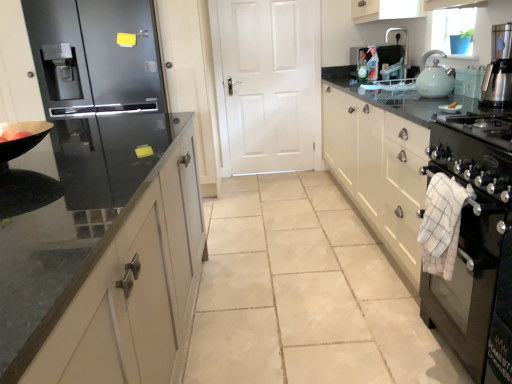
Question: Is white checkered towel at right thinner than black glossy countertop at right?

Choices:
 (A) yes
 (B) no

Answer: (A)

Question: From a real-world perspective, does white checkered towel at right sit lower than black glossy countertop at right?

Choices:
 (A) no
 (B) yes

Answer: (A)

Question: Could you tell me if white checkered towel at right is facing black glossy countertop at right?

Choices:
 (A) no
 (B) yes

Answer: (A)

Question: Does white checkered towel at right touch black glossy countertop at right?

Choices:
 (A) no
 (B) yes

Answer: (A)

Question: Could black glossy countertop at right be considered to be inside white checkered towel at right?

Choices:
 (A) no
 (B) yes

Answer: (A)

Question: From a real-world perspective, is matte orange tomato at left positioned above or below black glossy countertop at right?

Choices:
 (A) below
 (B) above

Answer: (B)

Question: Is point (18, 132) positioned closer to the camera than point (474, 268)?

Choices:
 (A) closer
 (B) farther

Answer: (B)

Question: From the image's perspective, is matte orange tomato at left located above or below black glossy countertop at right?

Choices:
 (A) above
 (B) below

Answer: (B)

Question: From their relative heights in the image, would you say matte orange tomato at left is taller or shorter than black glossy countertop at right?

Choices:
 (A) short
 (B) tall

Answer: (A)

Question: Considering the positions of point (28, 135) and point (83, 193), is point (28, 135) closer or farther from the camera than point (83, 193)?

Choices:
 (A) closer
 (B) farther

Answer: (B)

Question: Would you say matte orange tomato at left is inside or outside glossy black refrigerator at left?

Choices:
 (A) inside
 (B) outside

Answer: (B)

Question: Considering the positions of matte orange tomato at left and glossy black refrigerator at left in the image, is matte orange tomato at left wider or thinner than glossy black refrigerator at left?

Choices:
 (A) thin
 (B) wide

Answer: (A)

Question: Considering their positions, is matte orange tomato at left located in front of or behind glossy black refrigerator at left?

Choices:
 (A) front
 (B) behind

Answer: (A)

Question: In terms of width, does silver metallic faucet at upper right look wider or thinner when compared to black glossy countertop at right?

Choices:
 (A) thin
 (B) wide

Answer: (A)

Question: From a real-world perspective, is silver metallic faucet at upper right above or below black glossy countertop at right?

Choices:
 (A) above
 (B) below

Answer: (A)